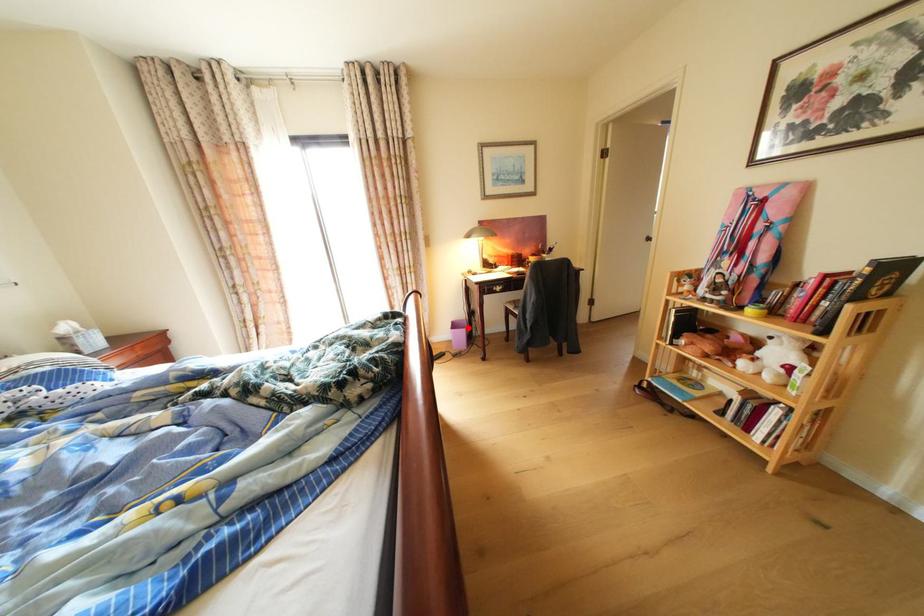
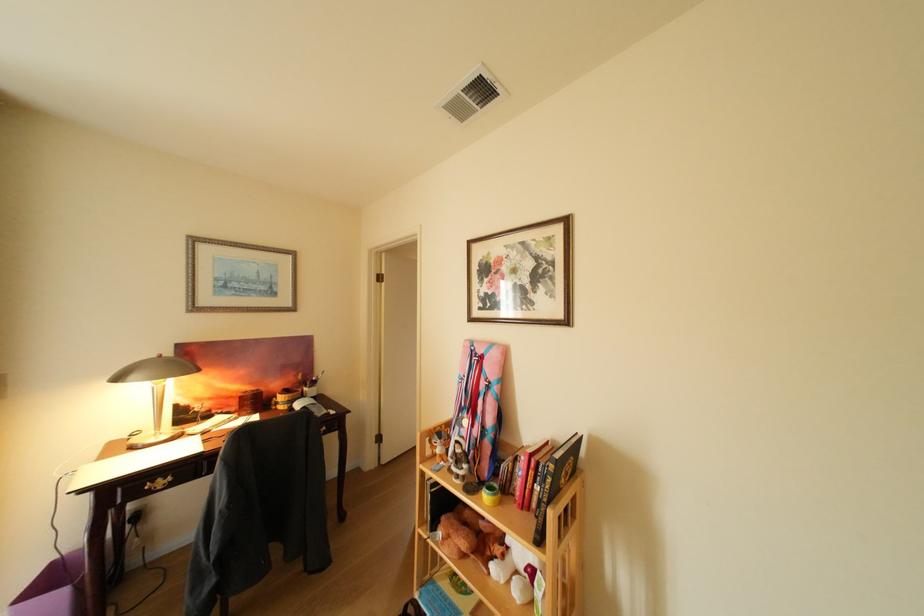
In the second image, find the point that corresponds to the highlighted location in the first image.

(62, 581)